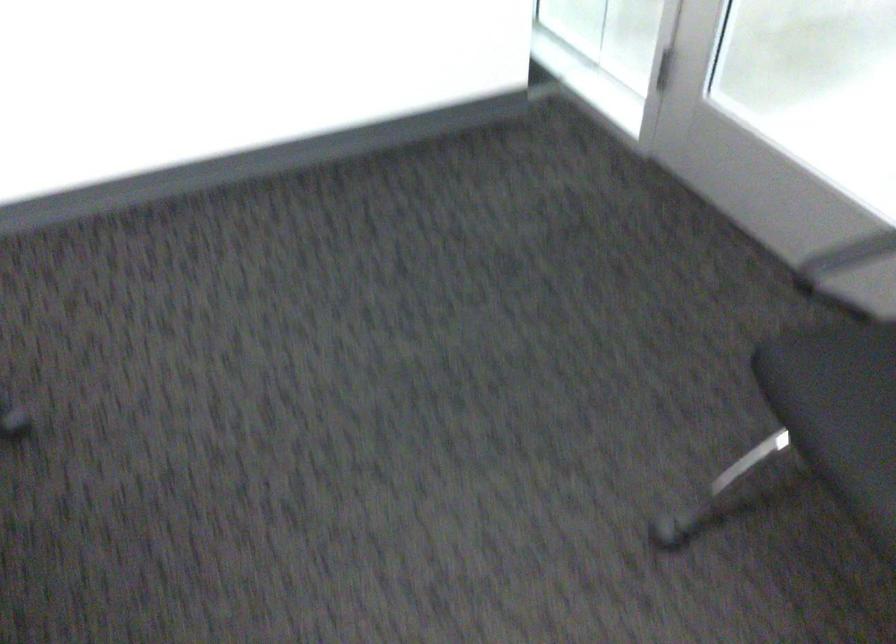
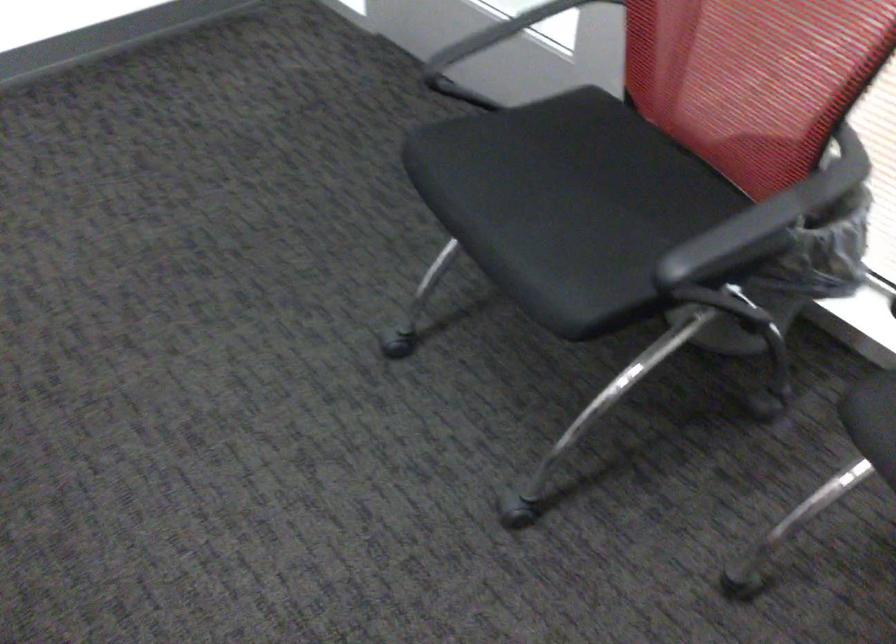
What movement of the cameraman would produce the second image?

The cameraman moved toward right, backward.